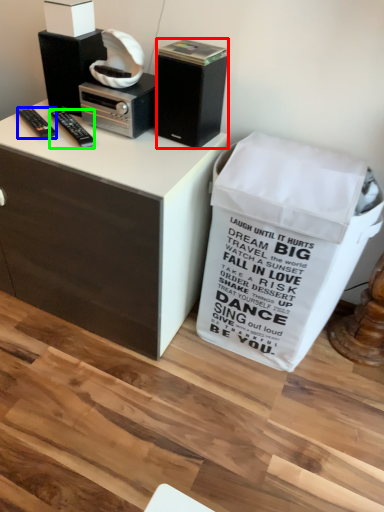
Question: Which object is positioned closest to loudspeaker (highlighted by a red box)? Select from remote control (highlighted by a blue box) and remote control (highlighted by a green box).

Choices:
 (A) remote control
 (B) remote control

Answer: (B)